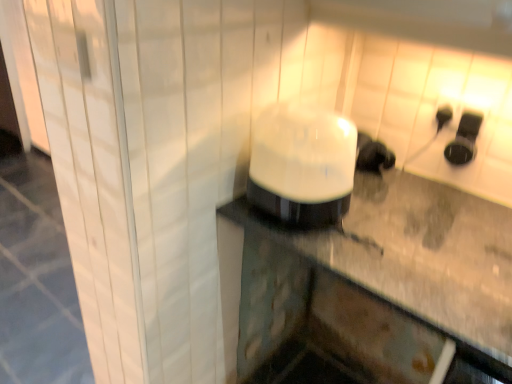
Question: Should I look upward or downward to see black rubber earbuds at upper right, marked as the 2th appliance in a left-to-right arrangement?

Choices:
 (A) down
 (B) up

Answer: (B)

Question: From a real-world perspective, is white glossy humidifier at center, placed as the 2th appliance when sorted from right to left, physically below black plastic outlet at upper right?

Choices:
 (A) no
 (B) yes

Answer: (B)

Question: From the image's perspective, is white glossy humidifier at center, which is counted as the 1th appliance, starting from the front, located above black plastic outlet at upper right?

Choices:
 (A) no
 (B) yes

Answer: (A)

Question: From the image's perspective, would you say white glossy humidifier at center, acting as the second appliance starting from the back, is shown under black plastic outlet at upper right?

Choices:
 (A) no
 (B) yes

Answer: (B)

Question: Is white glossy humidifier at center, placed as the 2th appliance when sorted from right to left, to the left of black plastic outlet at upper right from the viewer's perspective?

Choices:
 (A) no
 (B) yes

Answer: (B)

Question: Does white glossy humidifier at center, which is counted as the 1th appliance, starting from the front, have a lesser height compared to black plastic outlet at upper right?

Choices:
 (A) yes
 (B) no

Answer: (B)

Question: Would you say white glossy humidifier at center, which is counted as the 1th appliance, starting from the front, contains black plastic outlet at upper right?

Choices:
 (A) yes
 (B) no

Answer: (B)

Question: From a real-world perspective, is black plastic outlet at upper right physically below white glossy humidifier at center, which is counted as the 1th appliance, starting from the front?

Choices:
 (A) yes
 (B) no

Answer: (B)

Question: Is black plastic outlet at upper right closer to the viewer compared to white glossy humidifier at center, which is counted as the 1th appliance, starting from the front?

Choices:
 (A) no
 (B) yes

Answer: (A)

Question: From a real-world perspective, is black plastic outlet at upper right positioned over white glossy humidifier at center, marked as the first appliance in a left-to-right arrangement, based on gravity?

Choices:
 (A) yes
 (B) no

Answer: (A)

Question: Is black plastic outlet at upper right located outside white glossy humidifier at center, marked as the first appliance in a left-to-right arrangement?

Choices:
 (A) yes
 (B) no

Answer: (A)

Question: Is black plastic outlet at upper right positioned with its back to white glossy humidifier at center, which is counted as the 1th appliance, starting from the front?

Choices:
 (A) no
 (B) yes

Answer: (A)

Question: Can you confirm if black plastic outlet at upper right is positioned to the right of white glossy humidifier at center, acting as the second appliance starting from the back?

Choices:
 (A) no
 (B) yes

Answer: (B)

Question: From the image's perspective, does white glossy humidifier at center, placed as the 2th appliance when sorted from right to left, appear higher than black rubber earbuds at upper right, which appears as the 2th appliance when viewed from the front?

Choices:
 (A) yes
 (B) no

Answer: (B)